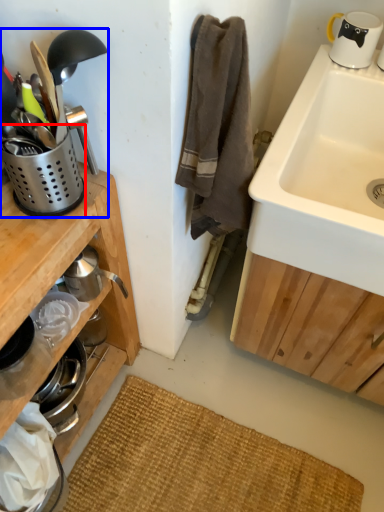
Question: Which of the following is the closest to the observer, appliance (highlighted by a red box) or appliance (highlighted by a blue box)?

Choices:
 (A) appliance
 (B) appliance

Answer: (B)